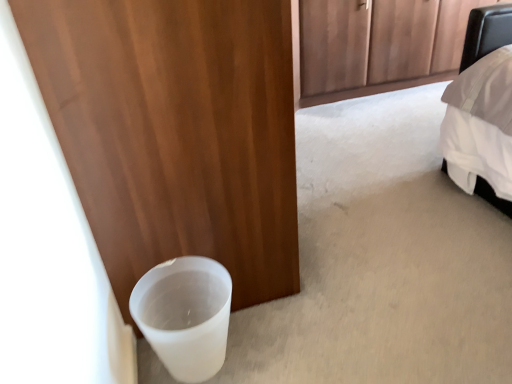
Question: Can you confirm if white matte cup at lower left is wider than white matte door at lower left?

Choices:
 (A) no
 (B) yes

Answer: (A)

Question: Would you say white matte cup at lower left is outside white matte door at lower left?

Choices:
 (A) yes
 (B) no

Answer: (A)

Question: From the image's perspective, would you say white matte cup at lower left is shown under white matte door at lower left?

Choices:
 (A) yes
 (B) no

Answer: (A)

Question: From the image's perspective, does white matte cup at lower left appear higher than white matte door at lower left?

Choices:
 (A) yes
 (B) no

Answer: (B)

Question: Is white matte cup at lower left taller than white matte door at lower left?

Choices:
 (A) no
 (B) yes

Answer: (A)

Question: Considering the relative sizes of white matte cup at lower left and white matte door at lower left in the image provided, is white matte cup at lower left shorter than white matte door at lower left?

Choices:
 (A) no
 (B) yes

Answer: (B)

Question: From the image's perspective, would you say white matte door at lower left is shown under white matte cup at lower left?

Choices:
 (A) no
 (B) yes

Answer: (A)

Question: Does white matte door at lower left have a smaller size compared to white matte cup at lower left?

Choices:
 (A) yes
 (B) no

Answer: (B)

Question: Does white matte door at lower left have a larger size compared to white matte cup at lower left?

Choices:
 (A) yes
 (B) no

Answer: (A)

Question: Considering the relative positions of white matte door at lower left and white matte cup at lower left in the image provided, is white matte door at lower left to the right of white matte cup at lower left from the viewer's perspective?

Choices:
 (A) yes
 (B) no

Answer: (B)

Question: Can you see white matte door at lower left touching white matte cup at lower left?

Choices:
 (A) yes
 (B) no

Answer: (B)

Question: From a real-world perspective, is white matte door at lower left beneath white matte cup at lower left?

Choices:
 (A) no
 (B) yes

Answer: (A)

Question: From a real-world perspective, is white matte cup at lower left physically located above or below white matte door at lower left?

Choices:
 (A) above
 (B) below

Answer: (B)